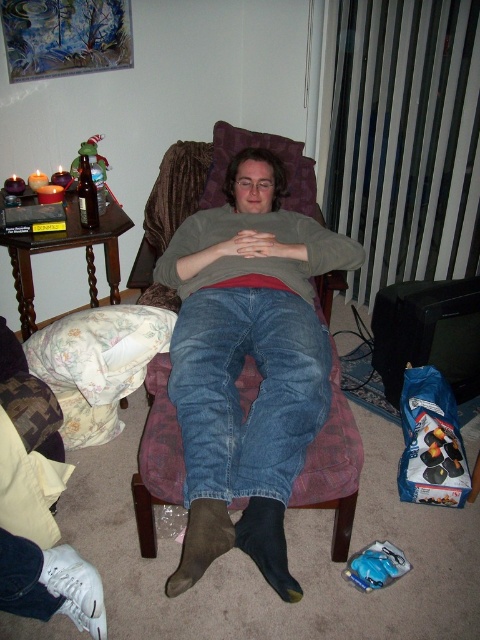
You are a fashion designer observing the scene. You need to determine if the denim jeans at center can be worn comfortably over the purple fabric armchair at center. Based on the spatial relationship between them, is this feasible?

The denim jeans at center is thinner than the purple fabric armchair at center, so it is not feasible to wear the denim jeans over the purple fabric armchair since the jeans are narrower and not designed to cover furniture.

You are a photographer setting up a shoot in this living room. You need to position a light source to the right of the purple fabric armchair at center. Can you place it there without overlapping the denim jeans at center?

The denim jeans at center is to the left of the purple fabric armchair at center, so placing the light source to the right of the purple fabric armchair at center would not overlap with the denim jeans at center.

You are a photographer trying to capture the denim jeans at center and the purple fabric armchair at center in a single shot. Based on their positions, can you tell which one is closer to the camera?

The denim jeans at center is located above the purple fabric armchair at center, which suggests that the denim jeans at center is closer to the camera than the purple fabric armchair at center.